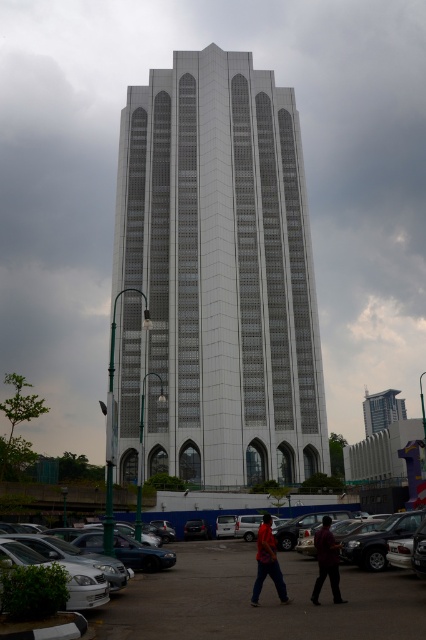
Question: Which object is positioned farthest from the metallic glass skyscraper at center?

Choices:
 (A) dark gray asphalt parking lot at lower center
 (B) dark red shirt at center

Answer: (B)

Question: Is white glass tower at center bigger than matte red shirt at center?

Choices:
 (A) no
 (B) yes

Answer: (B)

Question: Does dark gray asphalt parking lot at lower center have a lesser width compared to metallic glass skyscraper at center?

Choices:
 (A) yes
 (B) no

Answer: (A)

Question: Which object is farther from the camera taking this photo?

Choices:
 (A) dark red shirt at center
 (B) dark gray asphalt parking lot at lower center
 (C) matte red shirt at center
 (D) white glass tower at center

Answer: (D)

Question: Is dark gray asphalt parking lot at lower center closer to the viewer compared to metallic glass skyscraper at center?

Choices:
 (A) no
 (B) yes

Answer: (B)

Question: Based on their relative distances, which object is nearer to the dark gray asphalt parking lot at lower center?

Choices:
 (A) matte red shirt at center
 (B) dark red shirt at center

Answer: (A)